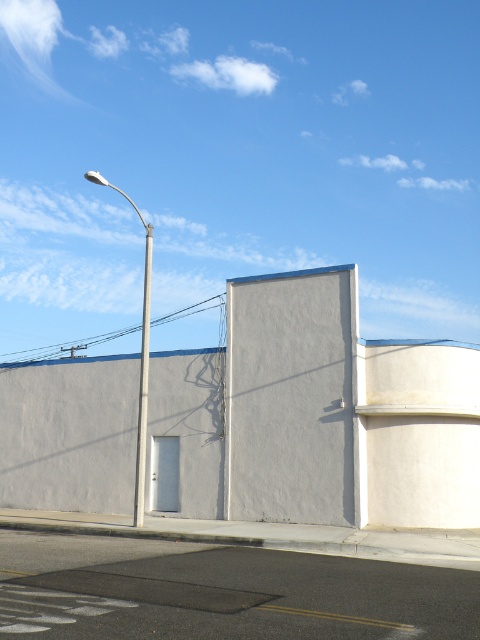
Question: Which object is farther from the camera taking this photo?

Choices:
 (A) smooth silver pole at center
 (B) metallic pole at left

Answer: (B)

Question: Does metallic pole at left appear over smooth silver pole at center?

Choices:
 (A) yes
 (B) no

Answer: (A)

Question: Which point is farther to the camera?

Choices:
 (A) metallic pole at left
 (B) smooth silver pole at center

Answer: (A)

Question: Is metallic pole at left below smooth silver pole at center?

Choices:
 (A) yes
 (B) no

Answer: (B)

Question: Does metallic pole at left have a smaller size compared to smooth silver pole at center?

Choices:
 (A) no
 (B) yes

Answer: (A)